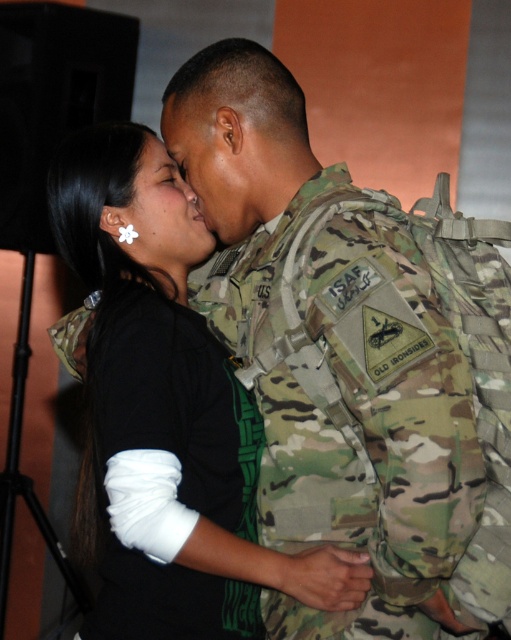
You are observing two military uniforms displayed side by side in a museum. You notice the camouflage uniform at center and the matte military uniform at center. Which one is taller?

The camouflage uniform at center is taller than the matte military uniform at center.

From the picture: You are a photographer trying to capture the interaction between the two people in the scene. You notice the camouflage uniform at center and the white flower at center. Which object is positioned lower in the image?

The camouflage uniform at center is located below the white flower at center, so the camouflage uniform at center is positioned lower in the image.